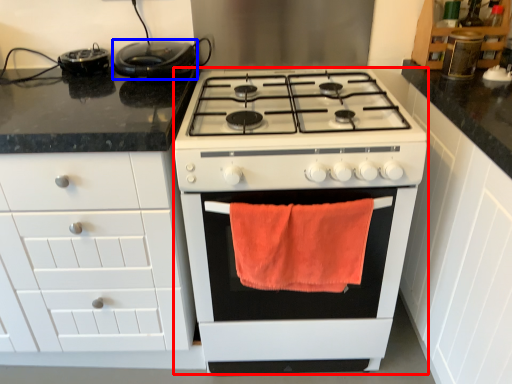
Question: Which object is closer to the camera taking this photo, appliance (highlighted by a red box) or kitchen appliance (highlighted by a blue box)?

Choices:
 (A) appliance
 (B) kitchen appliance

Answer: (A)